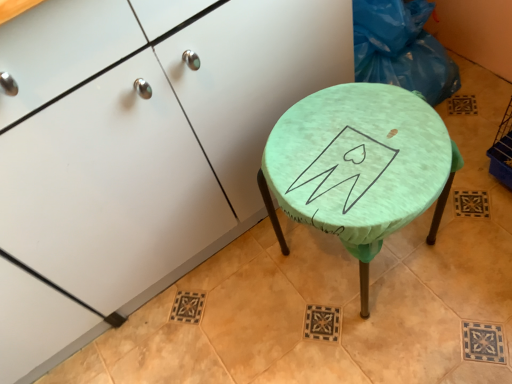
Question: From a real-world perspective, is matte white cabinet at center located higher than green fabric-covered stool at center?

Choices:
 (A) yes
 (B) no

Answer: (A)

Question: Is matte white cabinet at center aimed at green fabric-covered stool at center?

Choices:
 (A) yes
 (B) no

Answer: (A)

Question: Can you confirm if matte white cabinet at center is smaller than green fabric-covered stool at center?

Choices:
 (A) yes
 (B) no

Answer: (B)

Question: Considering the relative positions of matte white cabinet at center and green fabric-covered stool at center in the image provided, is matte white cabinet at center to the right of green fabric-covered stool at center from the viewer's perspective?

Choices:
 (A) no
 (B) yes

Answer: (A)

Question: Is matte white cabinet at center closer to camera compared to green fabric-covered stool at center?

Choices:
 (A) no
 (B) yes

Answer: (B)

Question: Is matte white cabinet at center beside green fabric-covered stool at center?

Choices:
 (A) yes
 (B) no

Answer: (B)

Question: Are blue plastic bag at upper right and green fabric-covered stool at center beside each other?

Choices:
 (A) no
 (B) yes

Answer: (A)

Question: Does blue plastic bag at upper right have a lesser height compared to green fabric-covered stool at center?

Choices:
 (A) no
 (B) yes

Answer: (B)

Question: Considering the relative sizes of blue plastic bag at upper right and green fabric-covered stool at center in the image provided, is blue plastic bag at upper right smaller than green fabric-covered stool at center?

Choices:
 (A) no
 (B) yes

Answer: (B)

Question: Does blue plastic bag at upper right come behind green fabric-covered stool at center?

Choices:
 (A) yes
 (B) no

Answer: (A)

Question: Is blue plastic bag at upper right to the left of green fabric-covered stool at center from the viewer's perspective?

Choices:
 (A) no
 (B) yes

Answer: (A)

Question: Is blue plastic bag at upper right in front of green fabric-covered stool at center?

Choices:
 (A) yes
 (B) no

Answer: (B)

Question: Is green fabric-covered stool at center wider than blue plastic bag at upper right?

Choices:
 (A) no
 (B) yes

Answer: (B)